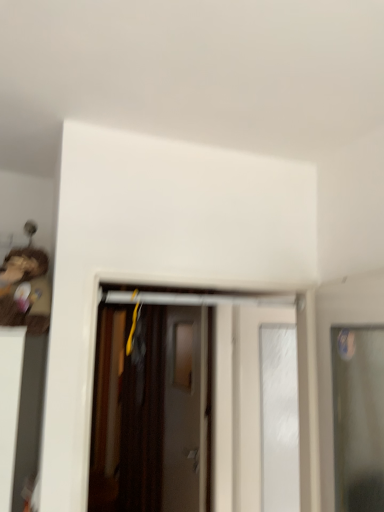
Question: Which direction should I rotate to look at white glossy door at center, which is counted as the 3th door, starting from the front, — up or down?

Choices:
 (A) down
 (B) up

Answer: (A)

Question: Does wooden toy at left have a greater width compared to transparent glass door at right, the 1th door from the front?

Choices:
 (A) no
 (B) yes

Answer: (B)

Question: Considering the relative positions of wooden toy at left and transparent glass door at right, the 1th door from the front, in the image provided, is wooden toy at left to the left of transparent glass door at right, the 1th door from the front, from the viewer's perspective?

Choices:
 (A) yes
 (B) no

Answer: (A)

Question: Is wooden toy at left taller than transparent glass door at right, placed as the fourth door when sorted from back to front?

Choices:
 (A) no
 (B) yes

Answer: (A)

Question: Is wooden toy at left bigger than transparent glass door at right, the 1th door from the front?

Choices:
 (A) no
 (B) yes

Answer: (A)

Question: Is wooden toy at left beside transparent glass door at right, the 1th door from the front?

Choices:
 (A) no
 (B) yes

Answer: (A)

Question: Would you say wooden toy at left is a long distance from transparent glass door at right, placed as the fourth door when sorted from back to front?

Choices:
 (A) yes
 (B) no

Answer: (A)

Question: Is wooden door at center, the first door in the back-to-front sequence, positioned with its back to matte brown door at center, positioned as the second door in front-to-back order?

Choices:
 (A) no
 (B) yes

Answer: (A)

Question: Can you confirm if wooden door at center, the first door in the back-to-front sequence, is positioned to the right of matte brown door at center, positioned as the second door in front-to-back order?

Choices:
 (A) no
 (B) yes

Answer: (A)

Question: Is wooden door at center, which appears as the 4th door when viewed from the front, smaller than matte brown door at center, positioned as the second door in front-to-back order?

Choices:
 (A) yes
 (B) no

Answer: (A)

Question: Considering the relative sizes of wooden door at center, the first door in the back-to-front sequence, and matte brown door at center, positioned as the second door in front-to-back order, in the image provided, is wooden door at center, the first door in the back-to-front sequence, taller than matte brown door at center, positioned as the second door in front-to-back order,?

Choices:
 (A) yes
 (B) no

Answer: (A)

Question: Is wooden door at center, the first door in the back-to-front sequence, facing towards matte brown door at center, positioned as the second door in front-to-back order?

Choices:
 (A) yes
 (B) no

Answer: (B)

Question: Can matte brown door at center, which is counted as the third door, starting from the back, be found inside wooden door at center, which appears as the 4th door when viewed from the front?

Choices:
 (A) yes
 (B) no

Answer: (B)

Question: From a real-world perspective, does wooden door at center, which appears as the 4th door when viewed from the front, stand above wooden toy at left?

Choices:
 (A) no
 (B) yes

Answer: (A)